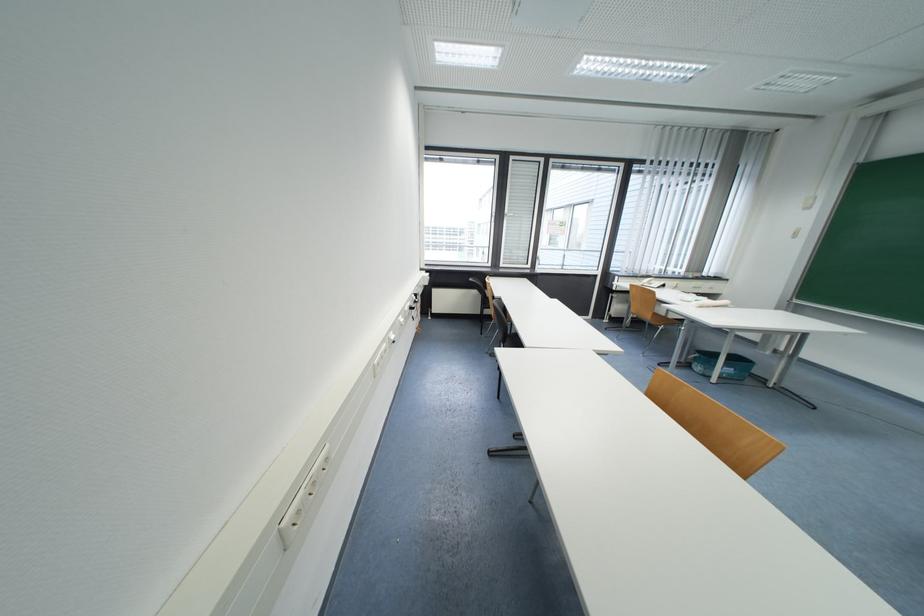
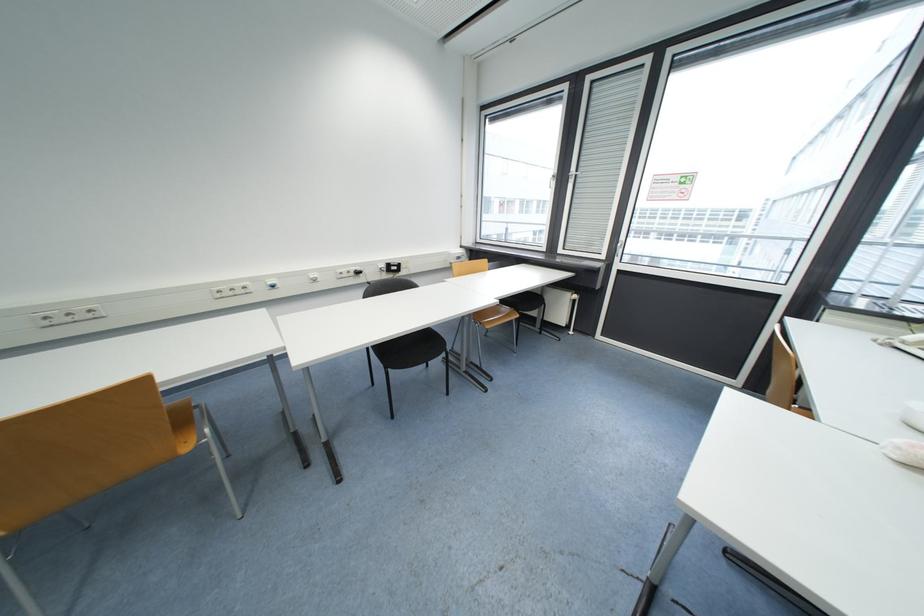
In the second image, find the point that corresponds to [517,160] in the first image.

(593, 81)